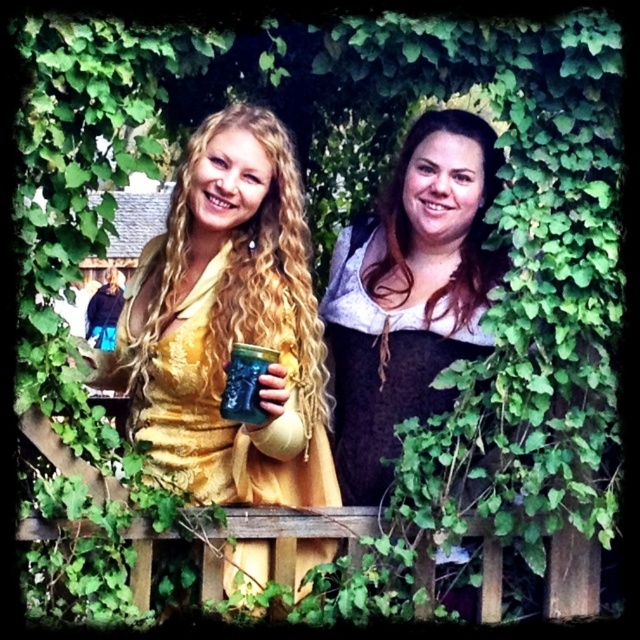
Is point (305, 356) behind point (259, 417)?

That is True.

Is matte yellow dress at center thinner than green glass jar at center?

No.

You are a GUI agent. You are given a task and a screenshot of the screen. Output one action in this format:
    pyautogui.click(x=<x>, y=<y>)
    Task: Click on the matte yellow dress at center
    The width and height of the screenshot is (640, 640).
    Given the screenshot: What is the action you would take?
    pyautogui.click(x=228, y=324)

Describe the element at coordinates (468, 225) in the screenshot. I see `brown matte dress at center` at that location.

Can you confirm if brown matte dress at center is positioned above green glass jar at center?

Indeed, brown matte dress at center is positioned over green glass jar at center.

Where is `brown matte dress at center`? This screenshot has width=640, height=640. brown matte dress at center is located at coordinates (468, 225).

Identify the location of brown matte dress at center. The image size is (640, 640). (468, 225).

Who is more distant from viewer, (436, 220) or (45, 529)?

Positioned behind is point (436, 220).

Can you confirm if dark brown leather dress at center is positioned to the left of wooden fence at center?

Incorrect, dark brown leather dress at center is not on the left side of wooden fence at center.

Find the location of a particular element. This screenshot has width=640, height=640. dark brown leather dress at center is located at coordinates (410, 292).